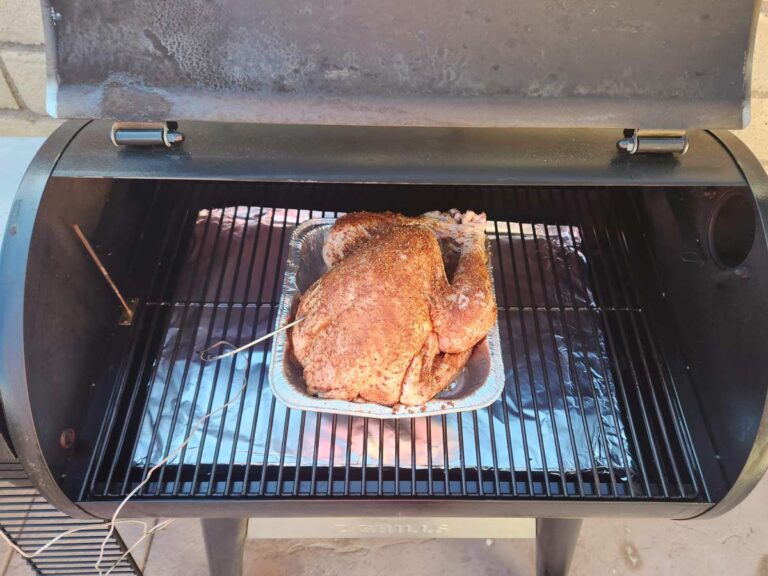
Find the location of a particular element. This screenshot has width=768, height=576. wall is located at coordinates (18, 56).